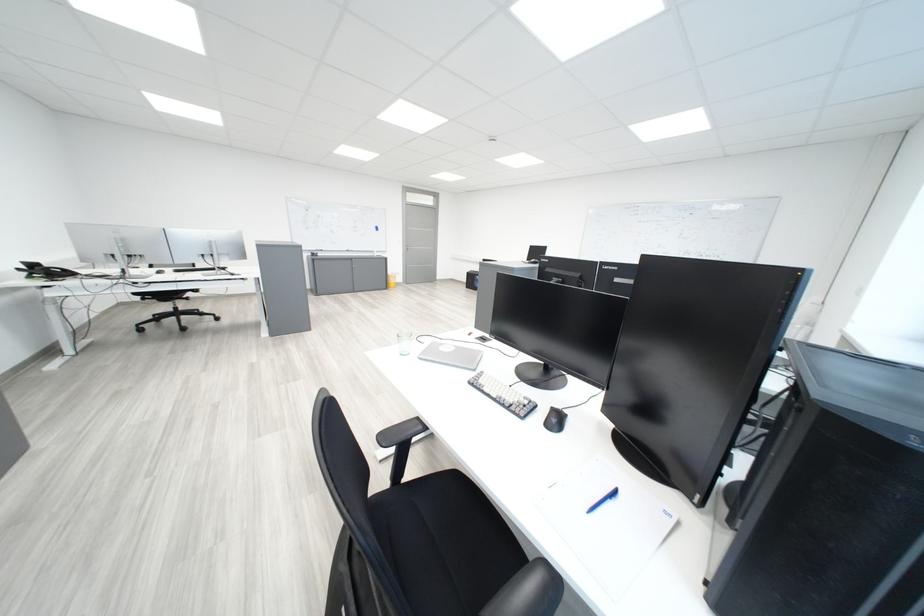
You are a GUI agent. You are given a task and a screenshot of the screen. Output one action in this format:
    pyautogui.click(x=<x>, y=<y>)
    Task: Click on the clear drinking glass
    
    Given the screenshot: What is the action you would take?
    pyautogui.click(x=404, y=342)